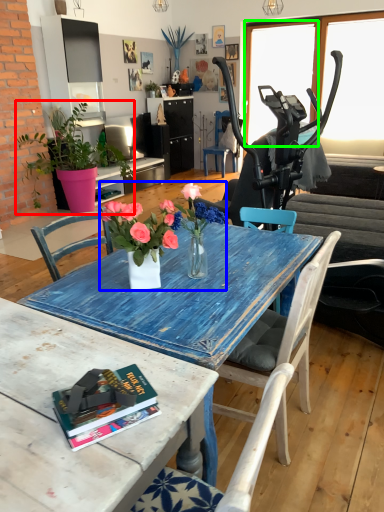
Question: Which object is the closest to the houseplant (highlighted by a red box)? Choose among these: floral arrangement (highlighted by a blue box) or window screen (highlighted by a green box).

Choices:
 (A) floral arrangement
 (B) window screen

Answer: (B)